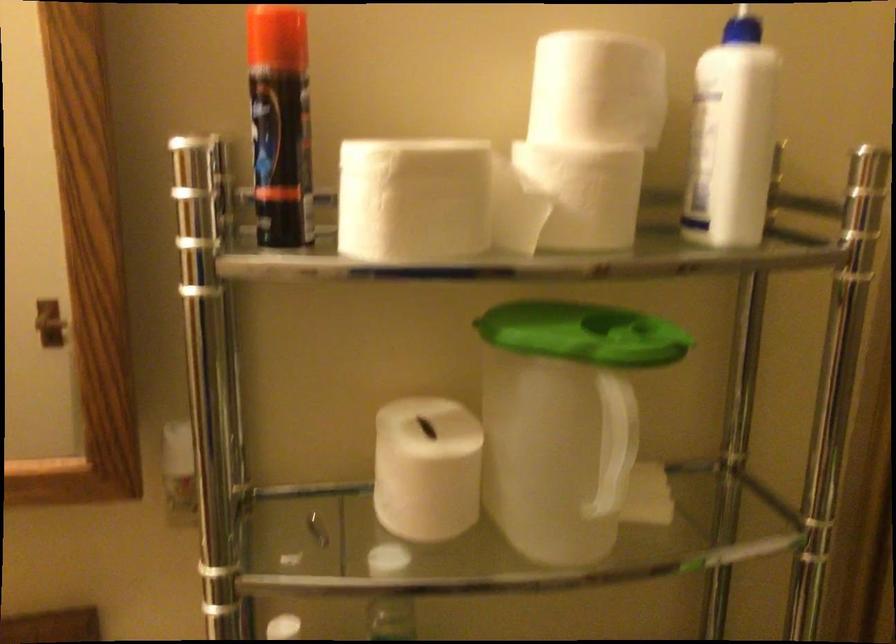
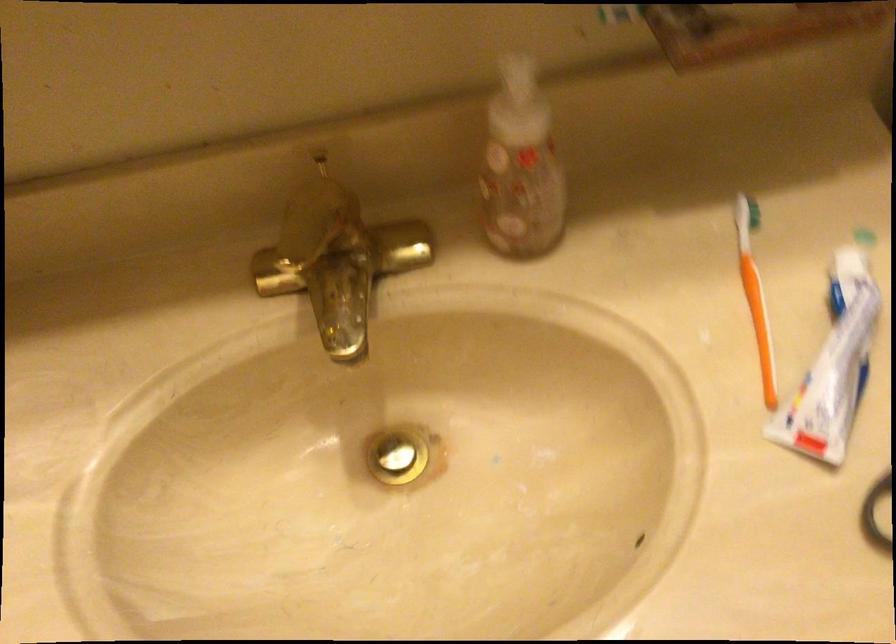
Question: Based on the continuous images, in which direction is the camera rotating? Reply with the corresponding letter.

Choices:
 (A) Left
 (B) Right
 (C) Up
 (D) Down

Answer: (D)